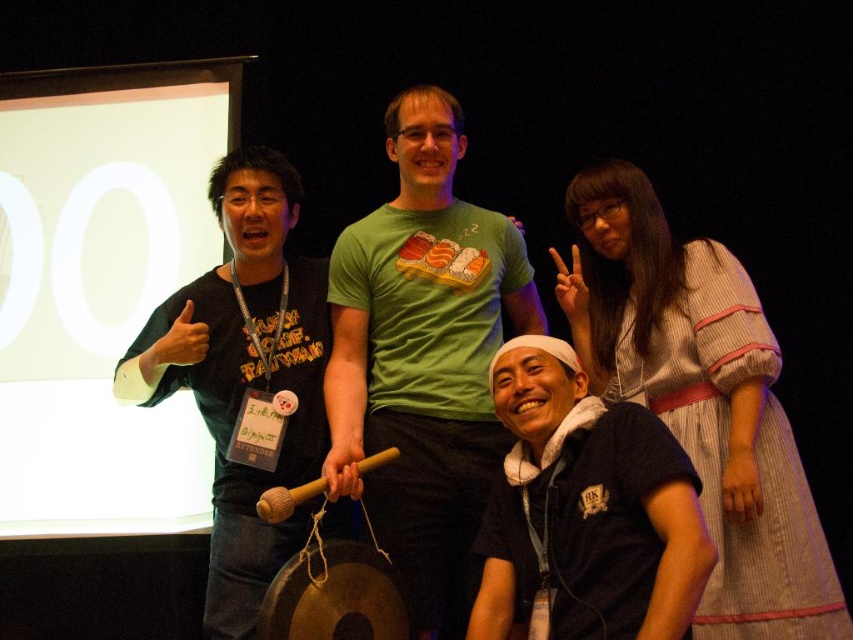
Question: Can you confirm if green t-shirt with sushi print at center is thinner than dark blue fabric at lower right?

Choices:
 (A) yes
 (B) no

Answer: (B)

Question: Estimate the real-world distances between objects in this image. Which object is closer to the green t-shirt with sushi print at center?

Choices:
 (A) black matte shirt at left
 (B) dark blue fabric at lower right

Answer: (A)

Question: Is dark blue fabric at lower right bigger than black matte shirt at left?

Choices:
 (A) no
 (B) yes

Answer: (A)

Question: Which object is positioned closest to the dark blue fabric at lower right?

Choices:
 (A) green t-shirt with sushi print at center
 (B) black matte shirt at left

Answer: (A)

Question: Is green t-shirt with sushi print at center bigger than black matte shirt at left?

Choices:
 (A) no
 (B) yes

Answer: (B)

Question: Which point is closer to the camera taking this photo?

Choices:
 (A) (521, 280)
 (B) (242, 580)

Answer: (B)